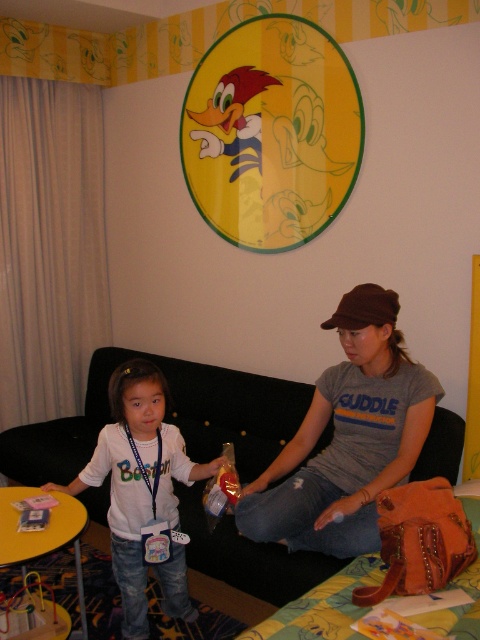
Does black fabric couch at center appear on the right side of brown fabric baseball cap at center?

Incorrect, black fabric couch at center is not on the right side of brown fabric baseball cap at center.

Can you confirm if black fabric couch at center is shorter than brown fabric baseball cap at center?

No, black fabric couch at center is not shorter than brown fabric baseball cap at center.

Describe the element at coordinates (167, 419) in the screenshot. I see `black fabric couch at center` at that location.

Find the location of `black fabric couch at center`. black fabric couch at center is located at coordinates (167, 419).

From the picture: Does gray cotton t-shirt at center come in front of white matte shirt at center?

Yes, it is in front of white matte shirt at center.

Is gray cotton t-shirt at center below white matte shirt at center?

Incorrect, gray cotton t-shirt at center is not positioned below white matte shirt at center.

Between point (241, 524) and point (91, 474), which one is positioned behind?

Positioned behind is point (91, 474).

Locate an element on the screen. This screenshot has height=640, width=480. gray cotton t-shirt at center is located at coordinates (348, 436).

Is point (303, 573) less distant than point (100, 442)?

That is True.

Can you confirm if black fabric couch at center is positioned to the right of white matte shirt at center?

Correct, you'll find black fabric couch at center to the right of white matte shirt at center.

Describe the element at coordinates (167, 419) in the screenshot. I see `black fabric couch at center` at that location.

Locate an element on the screen. Image resolution: width=480 pixels, height=640 pixels. black fabric couch at center is located at coordinates (167, 419).